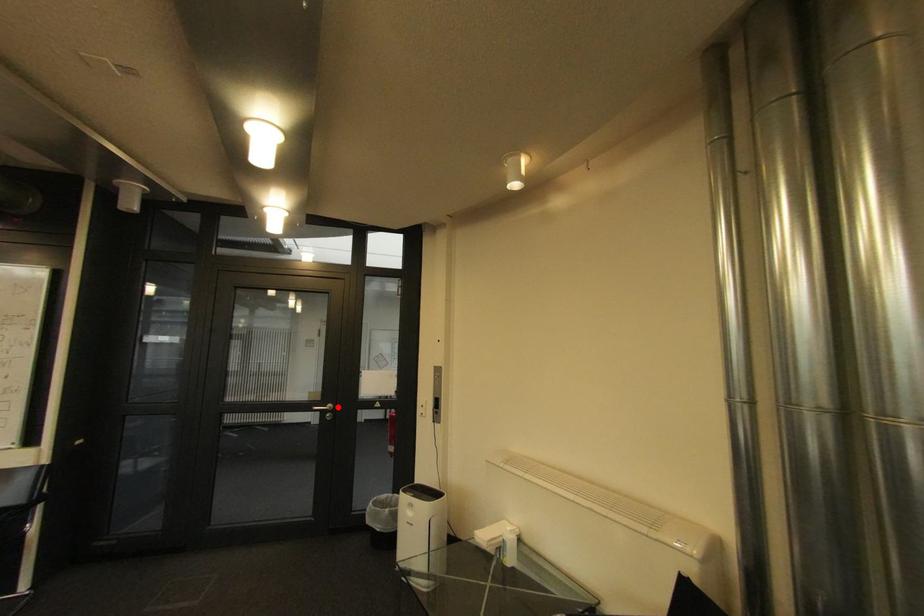
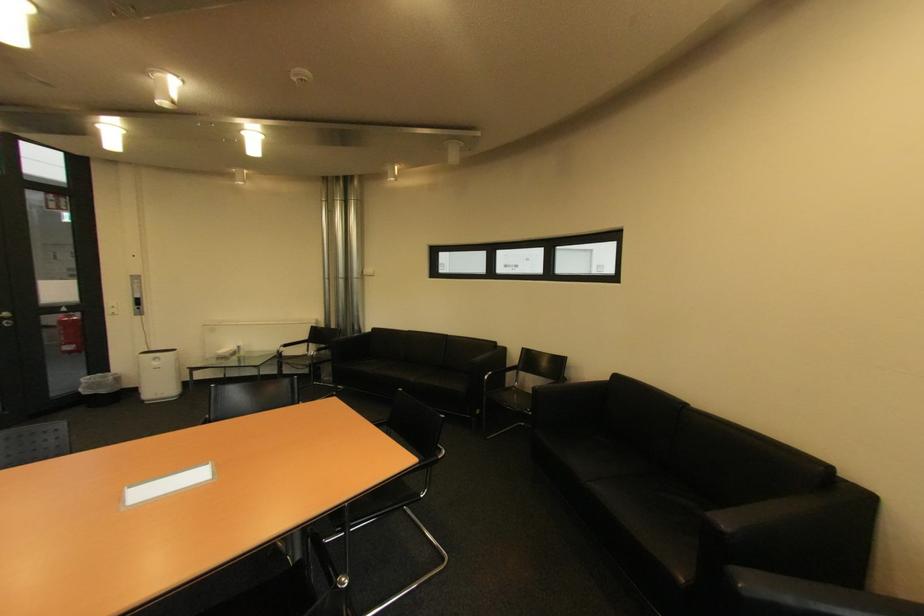
Where in the second image is the point corresponding to the highlighted location from the first image?

(14, 315)